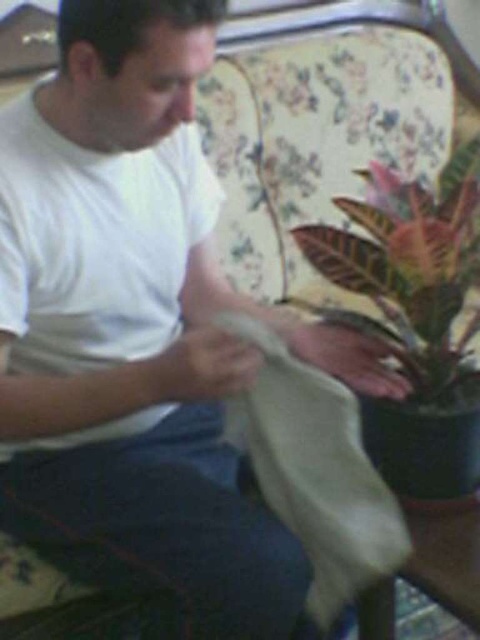
You are a photographer setting up a shoot in the room. You need to position a small lamp so that it illuminates the white matte cloth at lower center without casting a shadow from the leathery green leaf at right. Is this possible based on their positions?

The white matte cloth at lower center is below the leathery green leaf at right, so positioning the lamp above the leaf would allow light to reach the cloth while avoiding the leaf casting a shadow on it.

You are a photographer setting up a shoot in this room. You need to position a light source to the left of the white matte cloth at lower center and to the right of the leathery green leaf at right. Is this possible given their current positions?

The white matte cloth at lower center is to the left of the leathery green leaf at right, so placing a light source to the left of the cloth and to the right of the leaf would not be possible as the cloth is already positioned to the left of the leaf. The light source would need to be placed between them or adjust their positions.